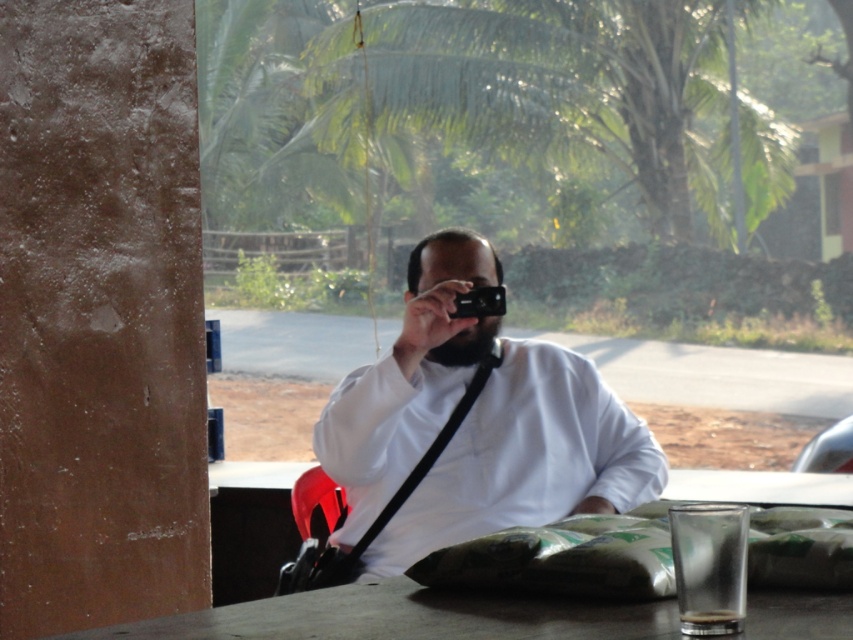
Can you confirm if white matte shirt at center is positioned above black plastic camera at center?

Actually, white matte shirt at center is below black plastic camera at center.

Does white matte shirt at center have a lesser height compared to black plastic camera at center?

Incorrect, white matte shirt at center's height does not fall short of black plastic camera at center's.

Does point (556, 488) come in front of point (467, 300)?

That is True.

Locate an element on the screen. Image resolution: width=853 pixels, height=640 pixels. white matte shirt at center is located at coordinates click(x=526, y=458).